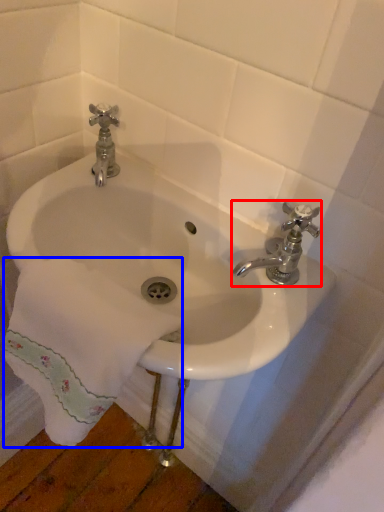
Question: Which object is further to the camera taking this photo, tap (highlighted by a red box) or bath towel (highlighted by a blue box)?

Choices:
 (A) tap
 (B) bath towel

Answer: (A)